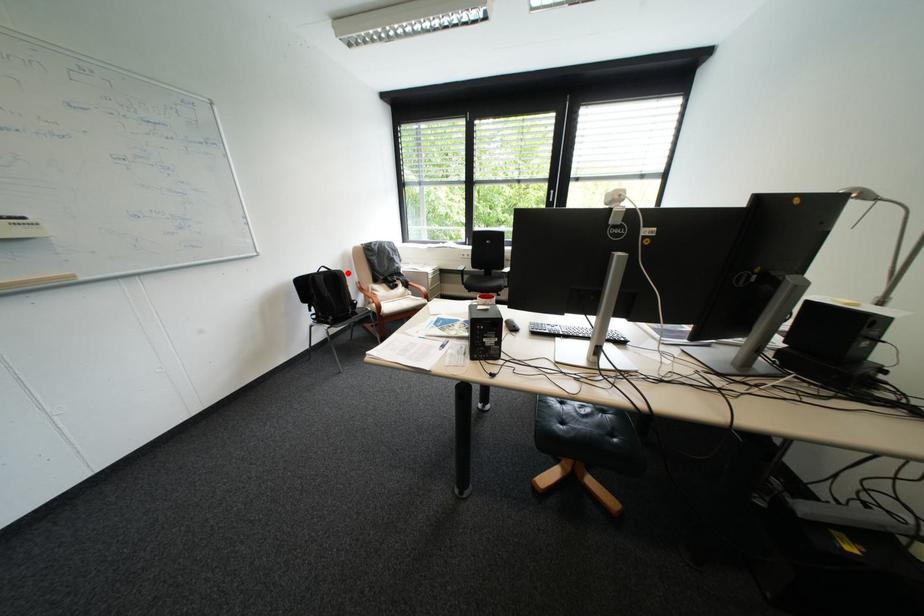
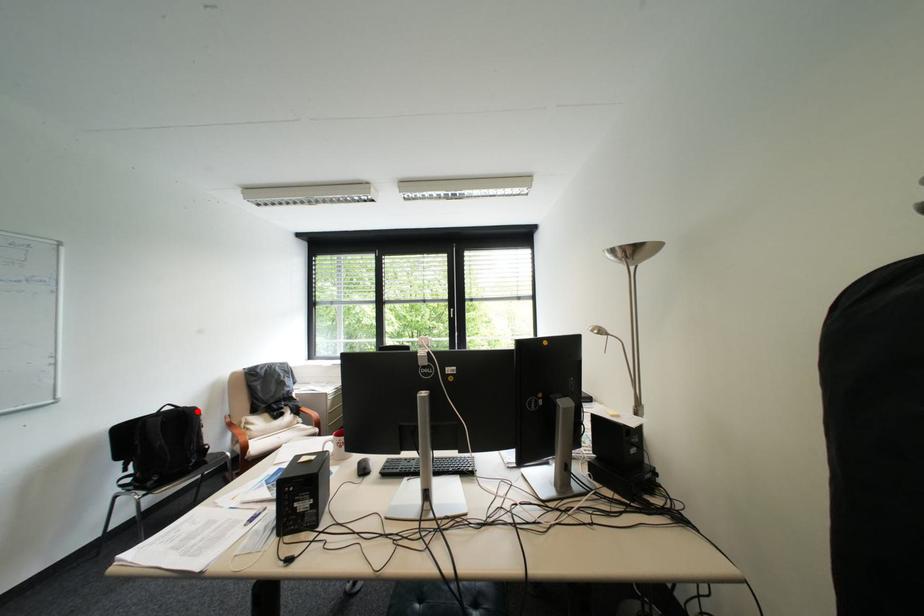
In the scene shown: I am providing you with two images of the same scene from different viewpoints. A red point is marked on the first image and another point is marked on the second image. Are the points marked in image1 and image2 representing the same 3D position?

Yes